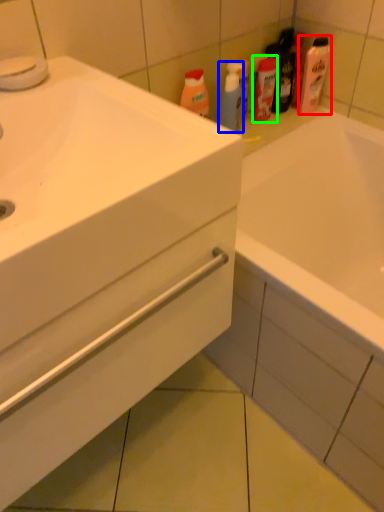
Question: Which is farther away from cleaning product (highlighted by a red box)? cleaning product (highlighted by a blue box) or mouthwash (highlighted by a green box)?

Choices:
 (A) cleaning product
 (B) mouthwash

Answer: (A)